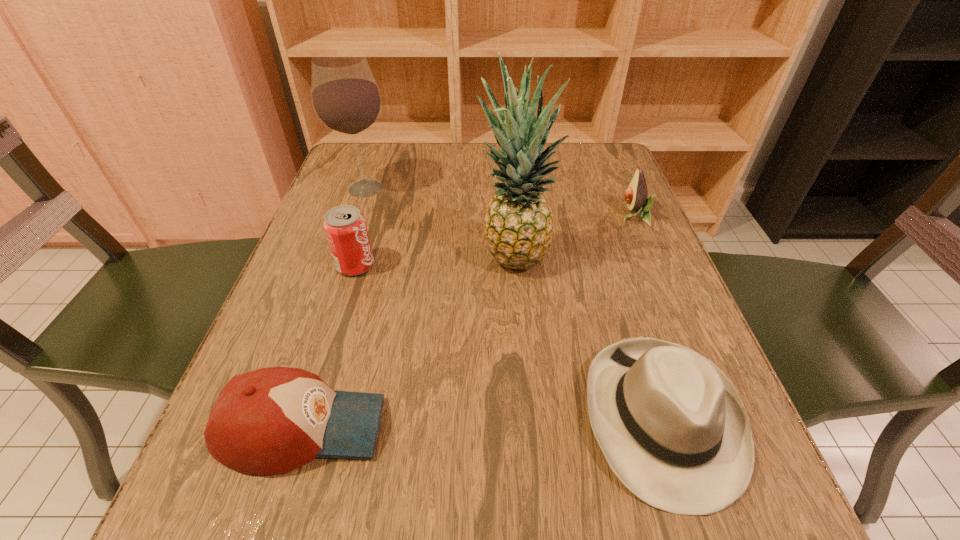
What are the coordinates of `fedora at the right edge` in the screenshot? It's located at (671, 425).

What are the coordinates of `object positioned at the far left corner` in the screenshot? It's located at (346, 99).

Find the location of a particular element. The height and width of the screenshot is (540, 960). object at the near right corner is located at coordinates (671, 425).

At what (x,y) coordinates should I click in order to perform the action: click on vacant space at the far edge of the desktop. Please return your answer as a coordinate pair (x, y). Looking at the image, I should click on (434, 185).

In the image, there is a desktop. Identify the location of vacant space at the near edge. The image size is (960, 540). (333, 533).

In the image, there is a desktop. Identify the location of vacant space at the left edge. The height and width of the screenshot is (540, 960). (330, 296).

The image size is (960, 540). What are the coordinates of `vacant space at the right edge` in the screenshot? It's located at (615, 254).

In the image, there is a desktop. Where is `vacant space at the far left corner`? This screenshot has width=960, height=540. vacant space at the far left corner is located at coordinates (347, 153).

I want to click on free region at the near left corner of the desktop, so click(x=265, y=526).

In the image, there is a desktop. Where is `free region at the far right corner`? free region at the far right corner is located at coordinates (562, 172).